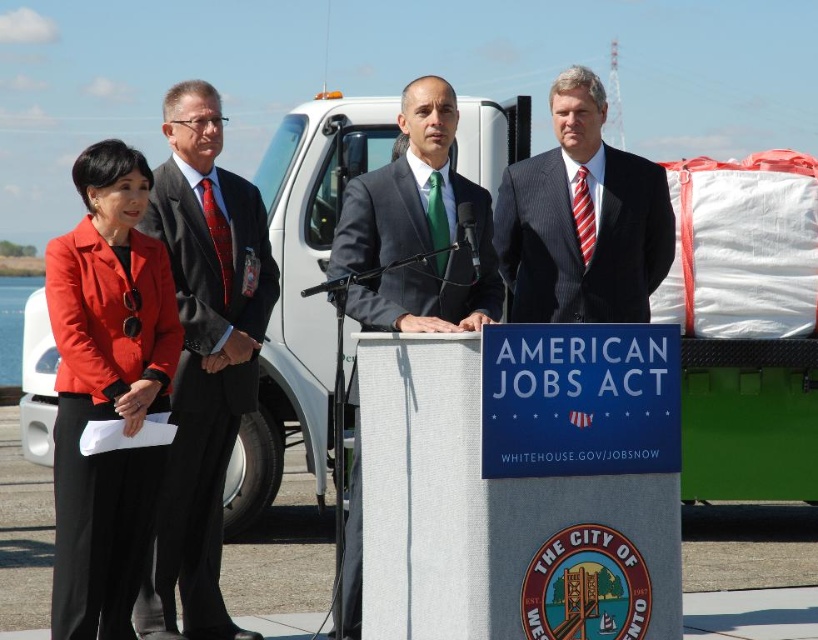
Question: Among these points, which one is farthest from the camera?

Choices:
 (A) (190, 376)
 (B) (381, 301)

Answer: (A)

Question: Based on their relative distances, which object is farther from the white matte podium at center?

Choices:
 (A) matte black suit at left
 (B) matte red blazer at left

Answer: (A)

Question: Can you confirm if matte red blazer at left is positioned to the right of matte black suit at left?

Choices:
 (A) no
 (B) yes

Answer: (A)

Question: Is white matte podium at center to the left of matte red blazer at left from the viewer's perspective?

Choices:
 (A) yes
 (B) no

Answer: (B)

Question: Does white matte podium at center have a greater width compared to matte black suit at left?

Choices:
 (A) no
 (B) yes

Answer: (B)

Question: Which object is the farthest from the matte black suit at left?

Choices:
 (A) matte gray suit at center
 (B) dark blue pinstripe suit at center
 (C) white matte podium at center

Answer: (C)